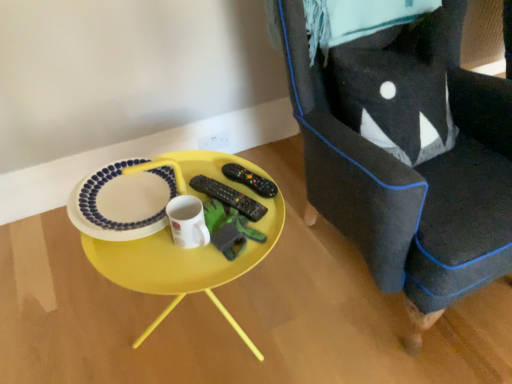
Question: Considering the relative sizes of black matte remote control at center, the 1th remote control from the left, and white glossy platter at center in the image provided, is black matte remote control at center, the 1th remote control from the left, taller than white glossy platter at center?

Choices:
 (A) no
 (B) yes

Answer: (A)

Question: Is white glossy platter at center at the back of black matte remote control at center, marked as the 2th remote control in a right-to-left arrangement?

Choices:
 (A) yes
 (B) no

Answer: (B)

Question: Is black matte remote control at center, the 1th remote control from the left, positioned behind white glossy platter at center?

Choices:
 (A) yes
 (B) no

Answer: (A)

Question: Is black matte remote control at center, the 1th remote control from the left, located outside white glossy platter at center?

Choices:
 (A) no
 (B) yes

Answer: (B)

Question: Does black matte remote control at center, the 1th remote control from the left, have a lesser height compared to white glossy platter at center?

Choices:
 (A) yes
 (B) no

Answer: (A)

Question: Relative to white glossy platter at center, is black plastic remote control at center, the first remote control positioned from the right, in front or behind?

Choices:
 (A) behind
 (B) front

Answer: (A)

Question: In the image, is black plastic remote control at center, the first remote control positioned from the right, on the left side or the right side of white glossy platter at center?

Choices:
 (A) left
 (B) right

Answer: (B)

Question: Looking at the image, does black plastic remote control at center, the 2th remote control in the left-to-right sequence, seem bigger or smaller compared to white glossy platter at center?

Choices:
 (A) small
 (B) big

Answer: (A)

Question: Looking at their shapes, would you say black plastic remote control at center, the first remote control positioned from the right, is wider or thinner than white glossy platter at center?

Choices:
 (A) thin
 (B) wide

Answer: (A)

Question: Considering the positions of green felt toy at center and black plastic remote control at center, the first remote control positioned from the right, in the image, is green felt toy at center wider or thinner than black plastic remote control at center, the first remote control positioned from the right,?

Choices:
 (A) wide
 (B) thin

Answer: (B)

Question: Considering the relative positions of green felt toy at center and black plastic remote control at center, the first remote control positioned from the right, in the image provided, is green felt toy at center to the left or to the right of black plastic remote control at center, the first remote control positioned from the right,?

Choices:
 (A) left
 (B) right

Answer: (A)

Question: Is green felt toy at center bigger or smaller than black plastic remote control at center, the 2th remote control in the left-to-right sequence?

Choices:
 (A) big
 (B) small

Answer: (A)

Question: Considering their positions, is green felt toy at center located in front of or behind black plastic remote control at center, the 2th remote control in the left-to-right sequence?

Choices:
 (A) front
 (B) behind

Answer: (A)

Question: From a real-world perspective, relative to white glossy platter at center, is yellow plastic table at center vertically above or below?

Choices:
 (A) below
 (B) above

Answer: (A)

Question: From their relative heights in the image, would you say yellow plastic table at center is taller or shorter than white glossy platter at center?

Choices:
 (A) short
 (B) tall

Answer: (B)